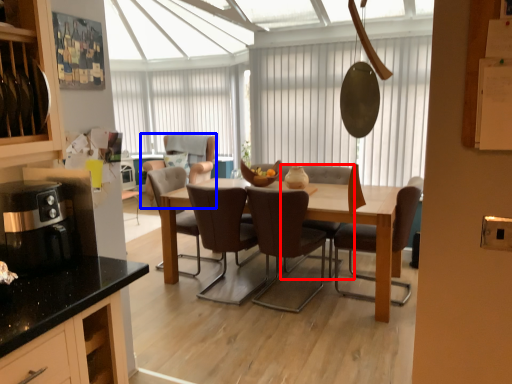
Question: Which of the following is the farthest to the observer, chair (highlighted by a red box) or chair (highlighted by a blue box)?

Choices:
 (A) chair
 (B) chair

Answer: (B)